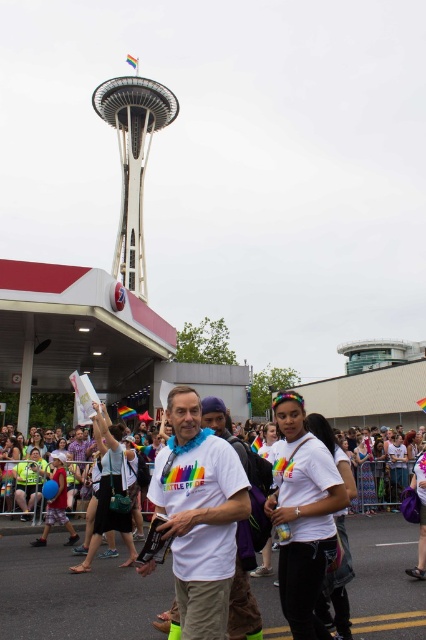
You are a photographer at the Seattle Pride parade, and you want to capture both the point at coordinates point (173, 497) and point (144, 276) in your shot. Which point should you focus on first to ensure both are in focus?

You should focus on point (173, 497) first because it is closer to the camera, ensuring both points will be in focus when using depth of field.